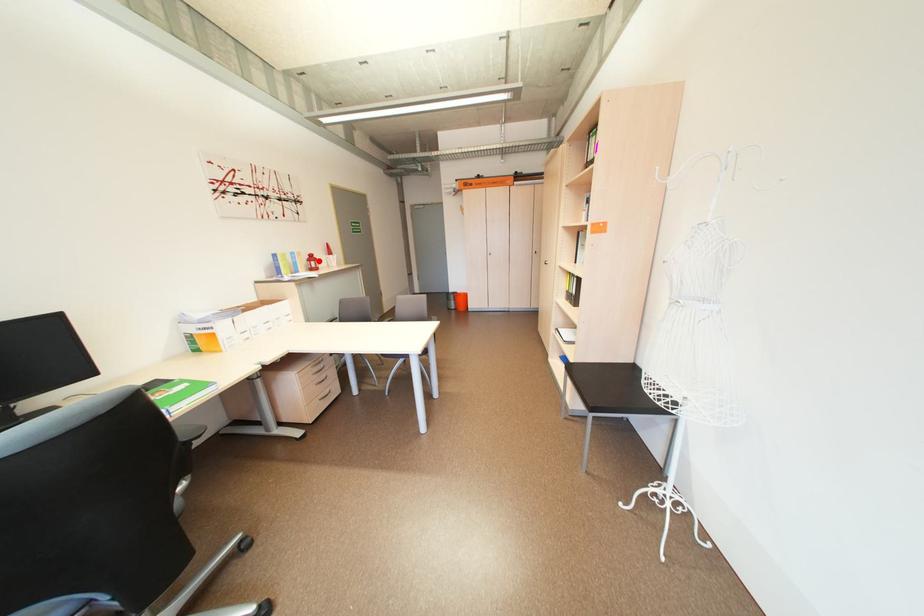
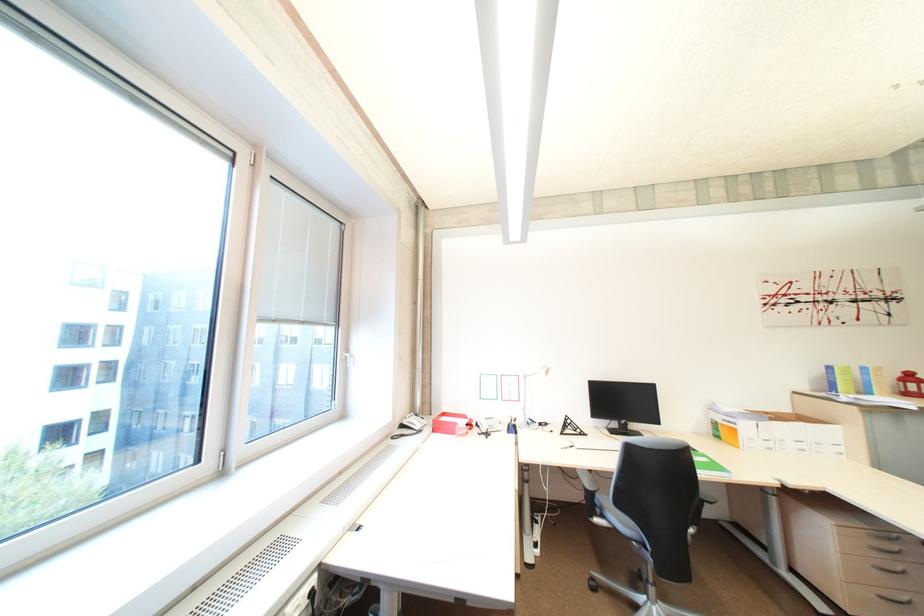
Question: A red point is marked in image1. In image2, is the corresponding 3D point closer to the camera or farther? Reply with the corresponding letter.

Choices:
 (A) The corresponding 3D point is closer.
 (B) The corresponding 3D point is farther.

Answer: (A)